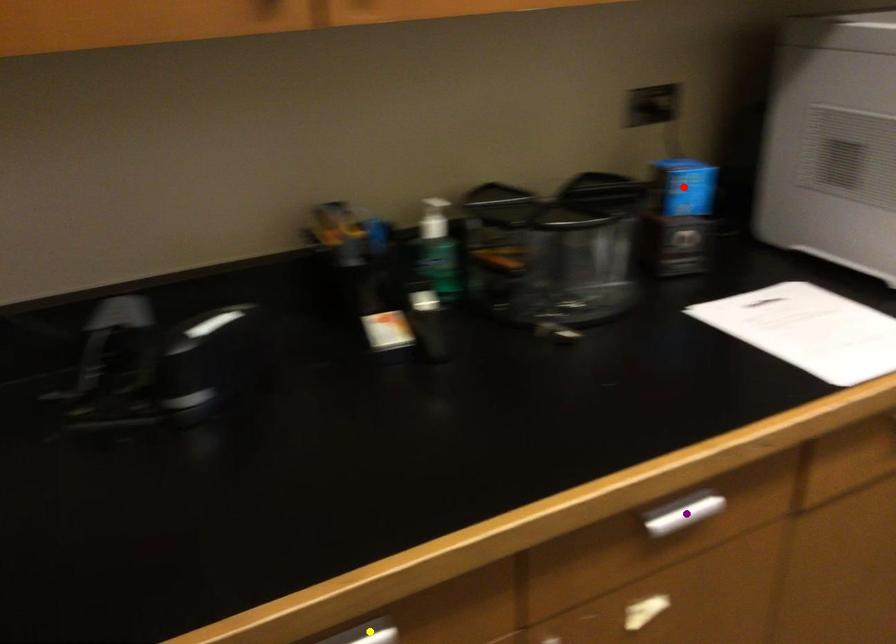
Order these from nearest to farthest:
1. red point
2. yellow point
3. purple point

red point
purple point
yellow point